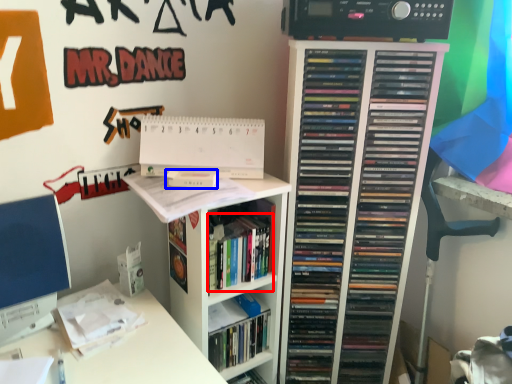
Question: Which of the following is the closest to the observer, book (highlighted by a red box) or paperback book (highlighted by a blue box)?

Choices:
 (A) book
 (B) paperback book

Answer: (A)